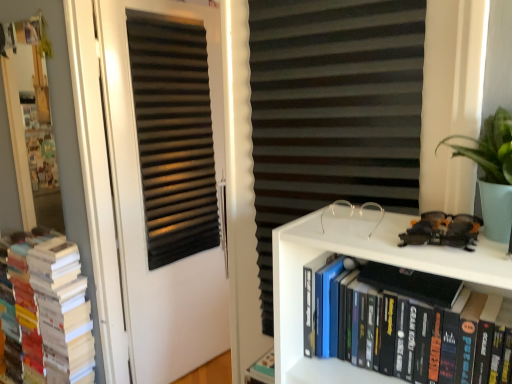
Question: Is black matte bookshelf at lower right, which is the 1th book from front to back, shorter than shiny plastic toy car at upper right?

Choices:
 (A) no
 (B) yes

Answer: (A)

Question: Could you tell me if black matte bookshelf at lower right, which is the 2th book in back-to-front order, is turned towards shiny plastic toy car at upper right?

Choices:
 (A) no
 (B) yes

Answer: (A)

Question: Is black matte bookshelf at lower right, which is counted as the second book, starting from the left, at the right side of shiny plastic toy car at upper right?

Choices:
 (A) no
 (B) yes

Answer: (A)

Question: Can you confirm if black matte bookshelf at lower right, which is the first book in right-to-left order, is wider than shiny plastic toy car at upper right?

Choices:
 (A) no
 (B) yes

Answer: (B)

Question: Can you confirm if black matte bookshelf at lower right, which is counted as the second book, starting from the left, is thinner than shiny plastic toy car at upper right?

Choices:
 (A) no
 (B) yes

Answer: (A)

Question: Does black matte bookshelf at lower right, which is counted as the second book, starting from the left, appear on the left side of shiny plastic toy car at upper right?

Choices:
 (A) no
 (B) yes

Answer: (B)

Question: Is black matte bookshelf at lower right, which is counted as the second book, starting from the left, at the right side of clear plastic glasses at upper center?

Choices:
 (A) no
 (B) yes

Answer: (B)

Question: Is black matte bookshelf at lower right, which is the first book in right-to-left order, shorter than clear plastic glasses at upper center?

Choices:
 (A) no
 (B) yes

Answer: (A)

Question: Is clear plastic glasses at upper center located within black matte bookshelf at lower right, which is the 1th book from front to back?

Choices:
 (A) yes
 (B) no

Answer: (B)

Question: Considering the relative sizes of black matte bookshelf at lower right, which is the first book in right-to-left order, and clear plastic glasses at upper center in the image provided, is black matte bookshelf at lower right, which is the first book in right-to-left order, bigger than clear plastic glasses at upper center?

Choices:
 (A) yes
 (B) no

Answer: (A)

Question: Is black matte bookshelf at lower right, which is the first book in right-to-left order, positioned with its back to clear plastic glasses at upper center?

Choices:
 (A) yes
 (B) no

Answer: (B)

Question: Is black matte bookshelf at lower right, which is the first book in right-to-left order, aimed at clear plastic glasses at upper center?

Choices:
 (A) yes
 (B) no

Answer: (B)

Question: From a real-world perspective, is white paper books at left, which is counted as the 1th book, starting from the left, located higher than black matte bookshelf at lower right, which is the 2th book in back-to-front order?

Choices:
 (A) yes
 (B) no

Answer: (B)